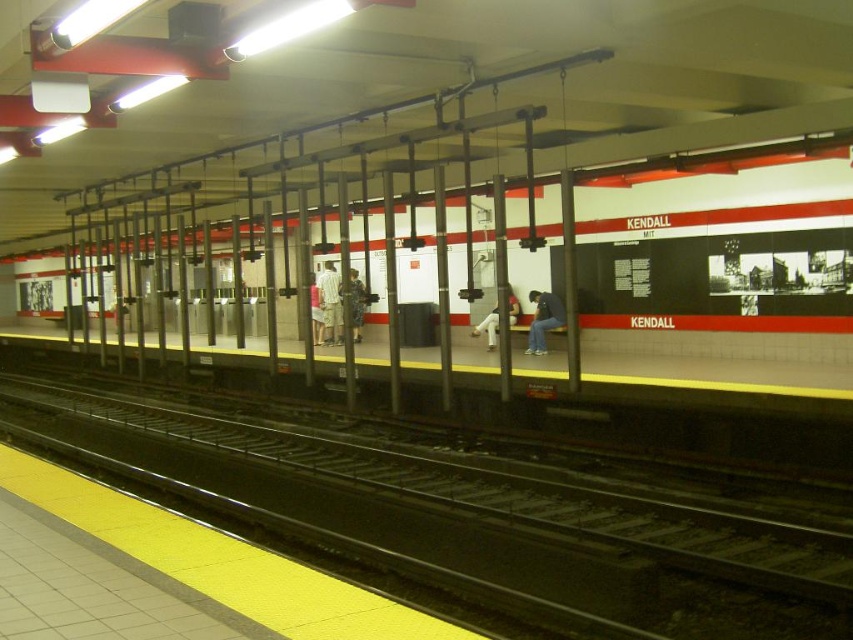
Question: Which point appears farthest from the camera in this image?

Choices:
 (A) (318, 339)
 (B) (555, 314)
 (C) (329, 292)

Answer: (A)

Question: Can you confirm if light gray fabric jacket at center is positioned above denim pants at center?

Choices:
 (A) no
 (B) yes

Answer: (B)

Question: Which object is positioned closest to the light gray shorts at center?

Choices:
 (A) light brown fabric shorts at center
 (B) light gray fabric jacket at center
 (C) denim pants at center

Answer: (A)

Question: Which object is closer to the camera taking this photo?

Choices:
 (A) black metal track at center
 (B) denim jacket at center
 (C) light brown fabric shorts at center
 (D) light gray fabric jacket at center

Answer: (A)

Question: Is black metal track at center bigger than light gray fabric jacket at center?

Choices:
 (A) yes
 (B) no

Answer: (A)

Question: Does black metal track at center have a lesser width compared to light gray fabric jacket at center?

Choices:
 (A) no
 (B) yes

Answer: (A)